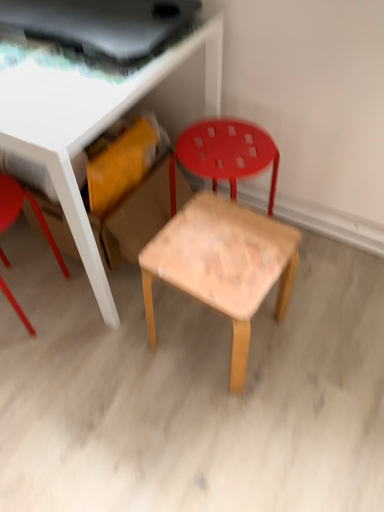
Question: Can you see wooden table at center touching natural wood stool at center?

Choices:
 (A) no
 (B) yes

Answer: (A)

Question: Is wooden table at center taller than natural wood stool at center?

Choices:
 (A) no
 (B) yes

Answer: (B)

Question: Does wooden table at center appear on the left side of natural wood stool at center?

Choices:
 (A) yes
 (B) no

Answer: (A)

Question: From a real-world perspective, is wooden table at center located beneath natural wood stool at center?

Choices:
 (A) no
 (B) yes

Answer: (A)

Question: Does wooden table at center have a larger size compared to natural wood stool at center?

Choices:
 (A) yes
 (B) no

Answer: (A)

Question: Does point (66, 275) appear closer or farther from the camera than point (81, 202)?

Choices:
 (A) farther
 (B) closer

Answer: (A)

Question: In terms of height, does matte red stool at left, which is the 1th chair from left to right, look taller or shorter compared to wooden table at center?

Choices:
 (A) short
 (B) tall

Answer: (A)

Question: From the image's perspective, is matte red stool at left, which is the 1th chair from left to right, above or below wooden table at center?

Choices:
 (A) below
 (B) above

Answer: (A)

Question: From a real-world perspective, relative to wooden table at center, is matte red stool at left, which is the 2th chair from right to left, vertically above or below?

Choices:
 (A) below
 (B) above

Answer: (A)

Question: From a real-world perspective, relative to wooden table at center, is wooden chair at center, marked as the second chair in a left-to-right arrangement, vertically above or below?

Choices:
 (A) below
 (B) above

Answer: (A)

Question: Looking at their shapes, would you say wooden chair at center, marked as the second chair in a left-to-right arrangement, is wider or thinner than wooden table at center?

Choices:
 (A) wide
 (B) thin

Answer: (B)

Question: Considering the positions of point (271, 139) and point (16, 73), is point (271, 139) closer or farther from the camera than point (16, 73)?

Choices:
 (A) closer
 (B) farther

Answer: (B)

Question: Is wooden chair at center, marked as the second chair in a left-to-right arrangement, bigger or smaller than wooden table at center?

Choices:
 (A) big
 (B) small

Answer: (B)

Question: In terms of height, does wooden table at center look taller or shorter compared to wooden chair at center, marked as the second chair in a left-to-right arrangement?

Choices:
 (A) tall
 (B) short

Answer: (A)

Question: Is wooden table at center spatially inside wooden chair at center, marked as the second chair in a left-to-right arrangement, or outside of it?

Choices:
 (A) outside
 (B) inside

Answer: (A)